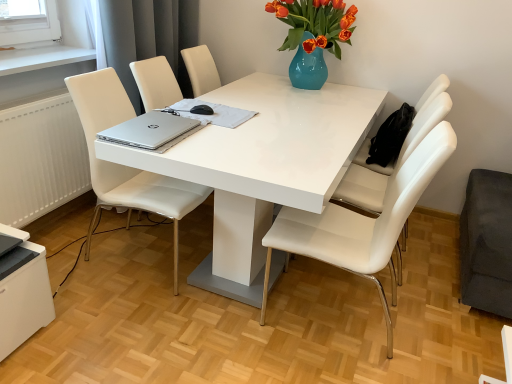
Question: Does point (100, 190) appear closer or farther from the camera than point (369, 190)?

Choices:
 (A) farther
 (B) closer

Answer: (B)

Question: Considering the relative positions of white leather chair at center, the third chair viewed from the right, and white leather chair at right, the third chair when ordered from left to right, in the image provided, is white leather chair at center, the third chair viewed from the right, to the left or to the right of white leather chair at right, the third chair when ordered from left to right,?

Choices:
 (A) left
 (B) right

Answer: (A)

Question: Which object is positioned closest to the white glossy table at center?

Choices:
 (A) white leather chair at right, which ranks as the second chair in left-to-right order
 (B) white leather chair at right, acting as the first chair starting from the right
 (C) gray fabric curtain at upper left
 (D) silver metallic laptop at center
 (E) white glossy desktop at lower left

Answer: (D)

Question: Which is farther from the white glossy table at center?

Choices:
 (A) white leather chair at right, acting as the first chair starting from the right
 (B) white glossy desktop at lower left
 (C) white leather chair at center, the third chair viewed from the right
 (D) white leather chair at right, which ranks as the second chair in left-to-right order
 (E) silver metallic laptop at center

Answer: (B)